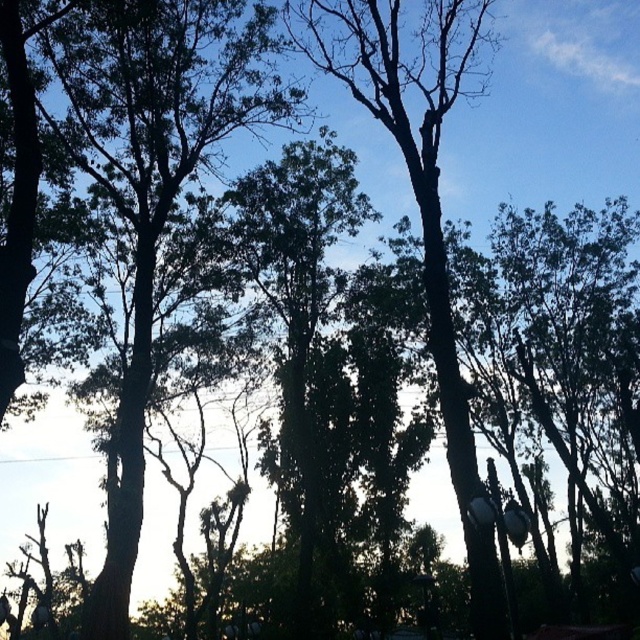
You are standing at the center of the image and want to walk towards the dark green leafy tree at upper left. In which direction should you head?

You should head towards the upper left direction to reach the dark green leafy tree at upper left, as its 2D location is at point [154,176].

You are a landscape architect planning to install a 3.5 meter wide walkway between the dark green leafy tree at upper left and the green leafy tree at center. Based on the scene, will the walkway fit comfortably between them?

The distance between the dark green leafy tree at upper left and the green leafy tree at center is 4.33 meters. Since the walkway is 3.5 meters wide, it will fit comfortably with 0.83 meters of space remaining.